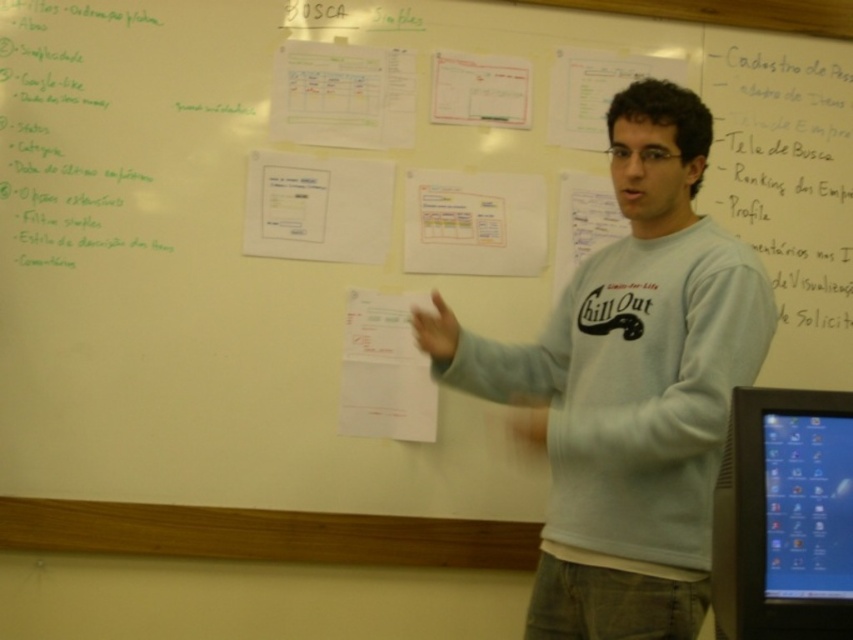
Question: Among these objects, which one is farthest from the camera?

Choices:
 (A) white cotton shirt at center
 (B) blue glossy monitor at right

Answer: (A)

Question: Which object appears farthest from the camera in this image?

Choices:
 (A) white cotton shirt at center
 (B) blue glossy monitor at right

Answer: (A)

Question: From the image, what is the correct spatial relationship of white cotton shirt at center in relation to blue glossy monitor at right?

Choices:
 (A) right
 (B) left

Answer: (B)

Question: Is white cotton shirt at center bigger than blue glossy monitor at right?

Choices:
 (A) yes
 (B) no

Answer: (A)

Question: Which of the following is the closest to the observer?

Choices:
 (A) (544, 332)
 (B) (799, 496)

Answer: (B)

Question: Can you confirm if white cotton shirt at center is smaller than blue glossy monitor at right?

Choices:
 (A) no
 (B) yes

Answer: (A)